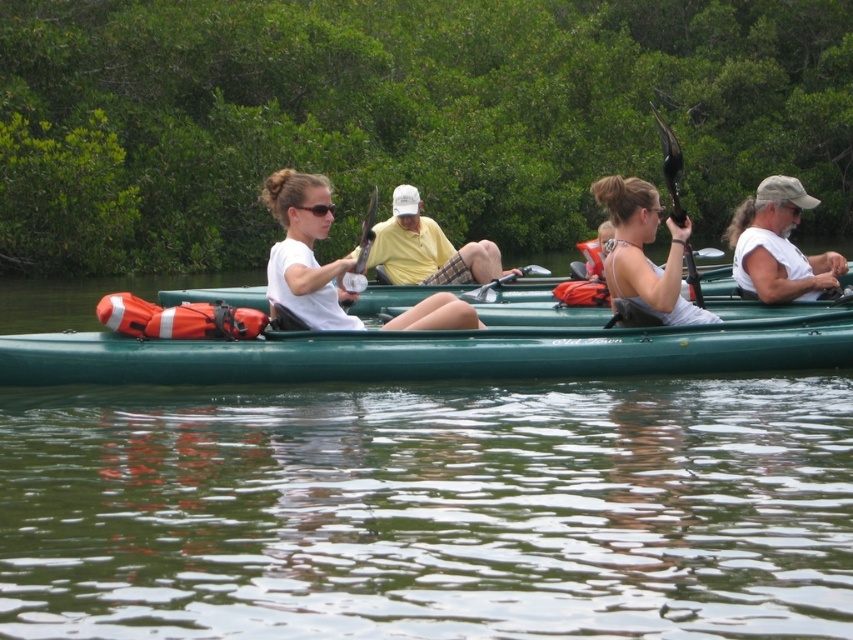
Looking at this image, can you confirm if green plastic kayak at center is shorter than white matte kayak at center?

Indeed, green plastic kayak at center has a lesser height compared to white matte kayak at center.

Based on the photo, which of these two, green plastic kayak at center or white matte kayak at center, stands taller?

With more height is white matte kayak at center.

Is point (3, 344) closer to viewer compared to point (323, 307)?

Yes, it is in front of point (323, 307).

Find the location of `green plastic kayak at center`. green plastic kayak at center is located at coordinates (434, 353).

Is point (772, 243) positioned before point (695, 294)?

No, it is not.

Is point (759, 184) behind point (650, 108)?

That is False.

The height and width of the screenshot is (640, 853). What are the coordinates of `white matte shirt at center` in the screenshot? It's located at (778, 244).

Is white matte shirt at center closer to camera compared to yellow cotton shirt at center?

No.

What do you see at coordinates (778, 244) in the screenshot? The image size is (853, 640). I see `white matte shirt at center` at bounding box center [778, 244].

Who is more forward, (778, 211) or (407, 209)?

Point (778, 211) is in front.

The height and width of the screenshot is (640, 853). Identify the location of white matte shirt at center. (778, 244).